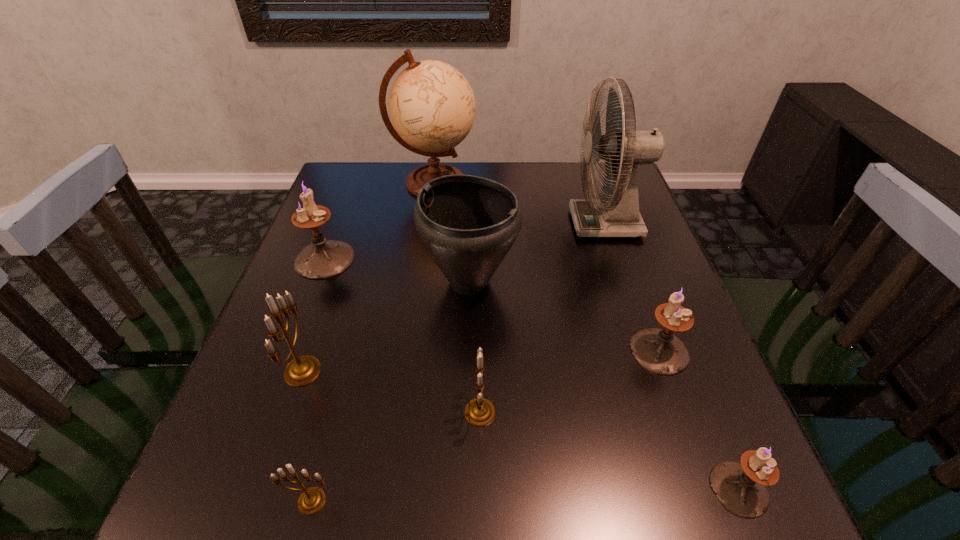
At what (x,y) coordinates should I click in order to perform the action: click on the smallest gold candelabrum. Please return your answer as a coordinate pair (x, y). Looking at the image, I should click on (312, 499).

Image resolution: width=960 pixels, height=540 pixels. I want to click on the smallest purple candle holder, so click(x=740, y=487).

Identify the location of free region located 0.280m on the surface of the beige globe. The width and height of the screenshot is (960, 540). (571, 183).

At what (x,y) coordinates should I click in order to perform the action: click on vacant space situated on the front-facing side of the fan. Please return your answer as a coordinate pair (x, y). This screenshot has height=540, width=960. Looking at the image, I should click on (477, 224).

At what (x,y) coordinates should I click in order to perform the action: click on vacant space located 0.140m on the front-facing side of the fan. Please return your answer as a coordinate pair (x, y). Image resolution: width=960 pixels, height=540 pixels. Looking at the image, I should click on (518, 224).

I want to click on vacant space situated on the front-facing side of the fan, so click(481, 224).

Where is `vacant position located on the right of the urn`? vacant position located on the right of the urn is located at coordinates (627, 282).

Image resolution: width=960 pixels, height=540 pixels. I want to click on vacant space positioned on the right of the biggest purple candle holder, so click(429, 259).

Image resolution: width=960 pixels, height=540 pixels. What are the coordinates of `vacant space situated 0.160m on the back of the biggest gold candelabrum` in the screenshot? It's located at (331, 288).

You are a GUI agent. You are given a task and a screenshot of the screen. Output one action in this format:
    pyautogui.click(x=<x>, y=<y>)
    Task: Click on the vacant space located 0.070m on the left of the second smallest purple candle holder
    This screenshot has width=960, height=540.
    Given the screenshot: What is the action you would take?
    pyautogui.click(x=595, y=351)